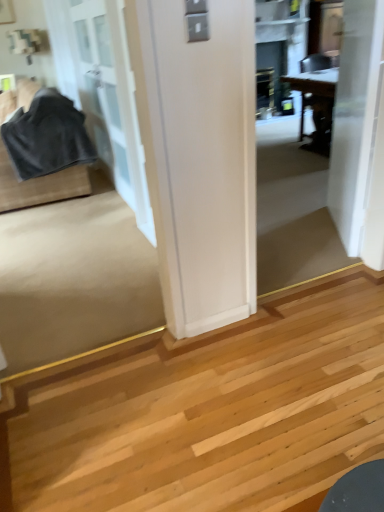
This screenshot has width=384, height=512. I want to click on white smooth door at upper right, which ranks as the first door in right-to-left order, so click(354, 116).

Describe the element at coordinates (44, 151) in the screenshot. I see `velvet-like black fabric at left` at that location.

The width and height of the screenshot is (384, 512). Identify the location of white glass door at left, arranged as the 1th door when viewed from the left. (113, 100).

In order to click on white smooth door at upper right, which ranks as the first door in right-to-left order in this screenshot , I will do `click(354, 116)`.

From the image's perspective, which one is positioned lower, white smooth door at upper right, which ranks as the first door in right-to-left order, or white glass door at left, the 2th door when ordered from right to left?

white smooth door at upper right, which ranks as the first door in right-to-left order, from the image's perspective.

Is point (338, 184) closer or farther from the camera than point (124, 198)?

Point (338, 184) is positioned closer to the camera compared to point (124, 198).

Can you confirm if white smooth door at upper right, which ranks as the second door in left-to-right order, is taller than white glass door at left, the 2th door when ordered from right to left?

In fact, white smooth door at upper right, which ranks as the second door in left-to-right order, may be shorter than white glass door at left, the 2th door when ordered from right to left.

Which object is closer to the camera, white smooth door at upper right, which ranks as the second door in left-to-right order, or white glass door at left, arranged as the 1th door when viewed from the left?

white smooth door at upper right, which ranks as the second door in left-to-right order, is closer to the camera.

How different are the orientations of white glass door at left, the 2th door when ordered from right to left, and white smooth door at upper right, which ranks as the second door in left-to-right order, in degrees?

white glass door at left, the 2th door when ordered from right to left, and white smooth door at upper right, which ranks as the second door in left-to-right order, are facing 29.6 degrees away from each other.

Is white glass door at left, arranged as the 1th door when viewed from the left, behind white smooth door at upper right, which ranks as the first door in right-to-left order?

Yes, the depth of white glass door at left, arranged as the 1th door when viewed from the left, is greater than that of white smooth door at upper right, which ranks as the first door in right-to-left order.

From the image's perspective, which is below, white glass door at left, arranged as the 1th door when viewed from the left, or white smooth door at upper right, which ranks as the second door in left-to-right order?

white smooth door at upper right, which ranks as the second door in left-to-right order, is shown below in the image.

Is white glass door at left, arranged as the 1th door when viewed from the left, smaller than white smooth door at upper right, which ranks as the second door in left-to-right order?

No.

How far apart are velvet-like black fabric at left and white glass door at left, arranged as the 1th door when viewed from the left?

They are 25.44 inches apart.

In the scene shown: How many degrees apart are the facing directions of velvet-like black fabric at left and white glass door at left, arranged as the 1th door when viewed from the left?

The angle between the facing direction of velvet-like black fabric at left and the facing direction of white glass door at left, arranged as the 1th door when viewed from the left, is 0.119 degrees.

Is velvet-like black fabric at left to the right of white glass door at left, arranged as the 1th door when viewed from the left, from the viewer's perspective?

In fact, velvet-like black fabric at left is to the left of white glass door at left, arranged as the 1th door when viewed from the left.

Relative to white glass door at left, arranged as the 1th door when viewed from the left, is velvet-like black fabric at left in front or behind?

velvet-like black fabric at left is positioned farther from the viewer than white glass door at left, arranged as the 1th door when viewed from the left.

Is white glass door at left, arranged as the 1th door when viewed from the left, to the left or to the right of velvet-like black fabric at left in the image?

Clearly, white glass door at left, arranged as the 1th door when viewed from the left, is on the right of velvet-like black fabric at left in the image.

How much distance is there between white glass door at left, arranged as the 1th door when viewed from the left, and velvet-like black fabric at left?

25.44 inches.

Is white glass door at left, the 2th door when ordered from right to left, turned away from velvet-like black fabric at left?

Yes, white glass door at left, the 2th door when ordered from right to left,'s orientation is away from velvet-like black fabric at left.

From the image's perspective, does white glass door at left, arranged as the 1th door when viewed from the left, appear lower than velvet-like black fabric at left?

Actually, white glass door at left, arranged as the 1th door when viewed from the left, appears above velvet-like black fabric at left in the image.

Starting from the velvet-like black fabric at left, which door is the 2nd one to the right? Please provide its 2D coordinates.

[(354, 116)]

Based on the photo, which object is positioned more to the right, white smooth door at upper right, which ranks as the first door in right-to-left order, or velvet-like black fabric at left?

white smooth door at upper right, which ranks as the first door in right-to-left order, is more to the right.

Between point (355, 179) and point (29, 108), which one is positioned behind?

The point (29, 108) is more distant.

Is white smooth door at upper right, which ranks as the first door in right-to-left order, thinner than velvet-like black fabric at left?

Yes, white smooth door at upper right, which ranks as the first door in right-to-left order, is thinner than velvet-like black fabric at left.

How different are the orientations of velvet-like black fabric at left and white smooth door at upper right, which ranks as the first door in right-to-left order, in degrees?

29.7 degrees.

Is velvet-like black fabric at left facing away from white smooth door at upper right, which ranks as the first door in right-to-left order?

That's not correct — velvet-like black fabric at left is not looking away from white smooth door at upper right, which ranks as the first door in right-to-left order.

Considering the positions of points (7, 130) and (345, 173), is point (7, 130) farther from camera compared to point (345, 173)?

Yes, point (7, 130) is farther from viewer.

Is velvet-like black fabric at left inside the boundaries of white smooth door at upper right, which ranks as the first door in right-to-left order, or outside?

velvet-like black fabric at left is outside white smooth door at upper right, which ranks as the first door in right-to-left order.

Where is `door located behind the white smooth door at upper right, which ranks as the second door in left-to-right order`? This screenshot has height=512, width=384. door located behind the white smooth door at upper right, which ranks as the second door in left-to-right order is located at coordinates (113, 100).

Where is `door that is under the white glass door at left, arranged as the 1th door when viewed from the left (from a real-world perspective)`? This screenshot has width=384, height=512. door that is under the white glass door at left, arranged as the 1th door when viewed from the left (from a real-world perspective) is located at coordinates (354, 116).

From the image, which object appears to be farther from white smooth door at upper right, which ranks as the second door in left-to-right order, white glass door at left, the 2th door when ordered from right to left, or velvet-like black fabric at left?

velvet-like black fabric at left is further to white smooth door at upper right, which ranks as the second door in left-to-right order.

When comparing their distances from velvet-like black fabric at left, does white glass door at left, the 2th door when ordered from right to left, or white smooth door at upper right, which ranks as the first door in right-to-left order, seem further?

white smooth door at upper right, which ranks as the first door in right-to-left order, is positioned further to the anchor velvet-like black fabric at left.

Looking at this image, which object lies further to the anchor point white glass door at left, arranged as the 1th door when viewed from the left, velvet-like black fabric at left or white smooth door at upper right, which ranks as the first door in right-to-left order?

white smooth door at upper right, which ranks as the first door in right-to-left order, is further to white glass door at left, arranged as the 1th door when viewed from the left.

Looking at this image, estimate the real-world distances between objects in this image. Which object is further from white smooth door at upper right, which ranks as the first door in right-to-left order, velvet-like black fabric at left or white glass door at left, the 2th door when ordered from right to left?

The object further to white smooth door at upper right, which ranks as the first door in right-to-left order, is velvet-like black fabric at left.

Which object lies further to the anchor point velvet-like black fabric at left, white smooth door at upper right, which ranks as the first door in right-to-left order, or white glass door at left, the 2th door when ordered from right to left?

white smooth door at upper right, which ranks as the first door in right-to-left order, is positioned further to the anchor velvet-like black fabric at left.

From the image, which object appears to be nearer to white glass door at left, arranged as the 1th door when viewed from the left, white smooth door at upper right, which ranks as the first door in right-to-left order, or velvet-like black fabric at left?

velvet-like black fabric at left.

This screenshot has width=384, height=512. What are the coordinates of `door between velvet-like black fabric at left and white smooth door at upper right, which ranks as the second door in left-to-right order, from left to right` in the screenshot? It's located at (113, 100).